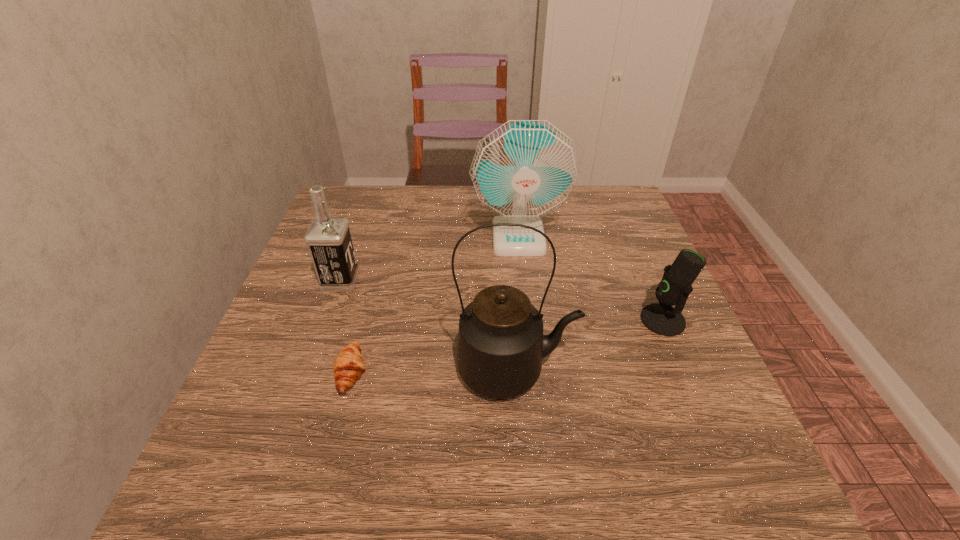
Where is `kettle`? Image resolution: width=960 pixels, height=540 pixels. kettle is located at coordinates (501, 344).

This screenshot has width=960, height=540. What are the coordinates of `fan` in the screenshot? It's located at (524, 169).

The image size is (960, 540). I want to click on the leftmost object, so click(x=328, y=238).

What are the coordinates of `vodka` in the screenshot? It's located at (328, 238).

Locate an element on the screen. The image size is (960, 540). microphone is located at coordinates (661, 318).

Image resolution: width=960 pixels, height=540 pixels. Find the location of `the rightmost object`. the rightmost object is located at coordinates (661, 318).

Locate an element on the screen. The width and height of the screenshot is (960, 540). pastry is located at coordinates (348, 366).

Identify the location of the second object from left to right. (348, 366).

This screenshot has height=540, width=960. I want to click on free location located 0.080m spout on the kettle, so pos(616,370).

At what (x,y) coordinates should I click in order to perform the action: click on blank area located 0.170m in front of the fan to face the airflow. Please return your answer as a coordinate pair (x, y). This screenshot has height=540, width=960. Looking at the image, I should click on (526, 306).